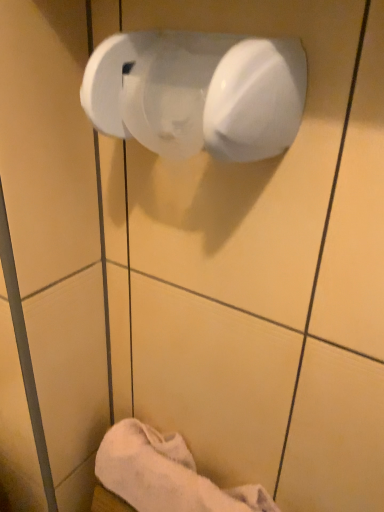
Question: Based on their sizes in the image, would you say white glossy toilet paper at upper center is bigger or smaller than white fluffy towel at lower left?

Choices:
 (A) small
 (B) big

Answer: (A)

Question: From their relative heights in the image, would you say white glossy toilet paper at upper center is taller or shorter than white fluffy towel at lower left?

Choices:
 (A) tall
 (B) short

Answer: (B)

Question: Considering their positions, is white glossy toilet paper at upper center located in front of or behind white fluffy towel at lower left?

Choices:
 (A) front
 (B) behind

Answer: (A)

Question: Is point (155, 503) positioned closer to the camera than point (288, 139)?

Choices:
 (A) farther
 (B) closer

Answer: (A)

Question: Looking at the image, does white fluffy towel at lower left seem bigger or smaller compared to white glossy toilet paper at upper center?

Choices:
 (A) big
 (B) small

Answer: (A)

Question: Is white fluffy towel at lower left taller or shorter than white glossy toilet paper at upper center?

Choices:
 (A) short
 (B) tall

Answer: (B)

Question: From a real-world perspective, relative to white glossy toilet paper at upper center, is white fluffy towel at lower left vertically above or below?

Choices:
 (A) below
 (B) above

Answer: (A)